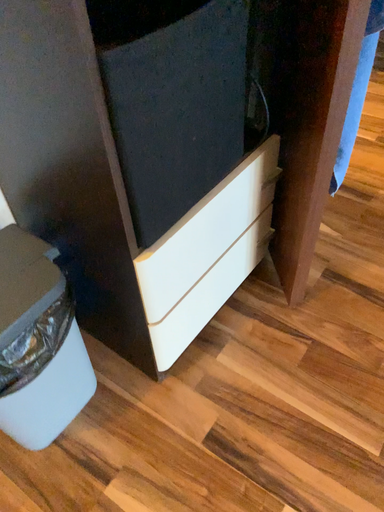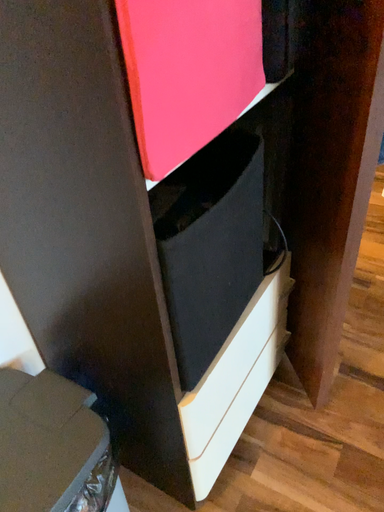
Question: How did the camera likely rotate when shooting the video?

Choices:
 (A) rotated downward
 (B) rotated upward

Answer: (B)